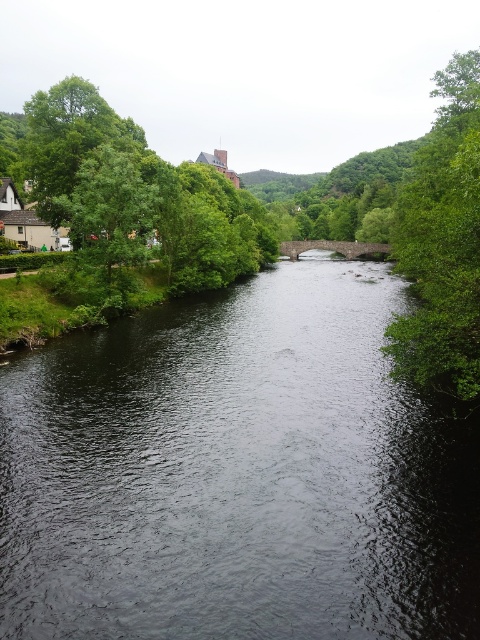
Question: Can you confirm if green leafy tree at upper left is bigger than green leafy tree at left?

Choices:
 (A) no
 (B) yes

Answer: (B)

Question: Which of the following is the closest to the observer?

Choices:
 (A) green leafy tree at upper left
 (B) dark gray water at center

Answer: (B)

Question: Is green leafy tree at right to the left of green leafy tree at left from the viewer's perspective?

Choices:
 (A) yes
 (B) no

Answer: (B)

Question: Which point is farther to the camera?

Choices:
 (A) (122, 177)
 (B) (262, 250)

Answer: (B)

Question: Considering the relative positions of dark gray water at center and green leafy tree at right in the image provided, where is dark gray water at center located with respect to green leafy tree at right?

Choices:
 (A) left
 (B) right

Answer: (A)

Question: Estimate the real-world distances between objects in this image. Which object is closer to the green leafy tree at upper left?

Choices:
 (A) green leafy tree at right
 (B) dark gray water at center

Answer: (A)